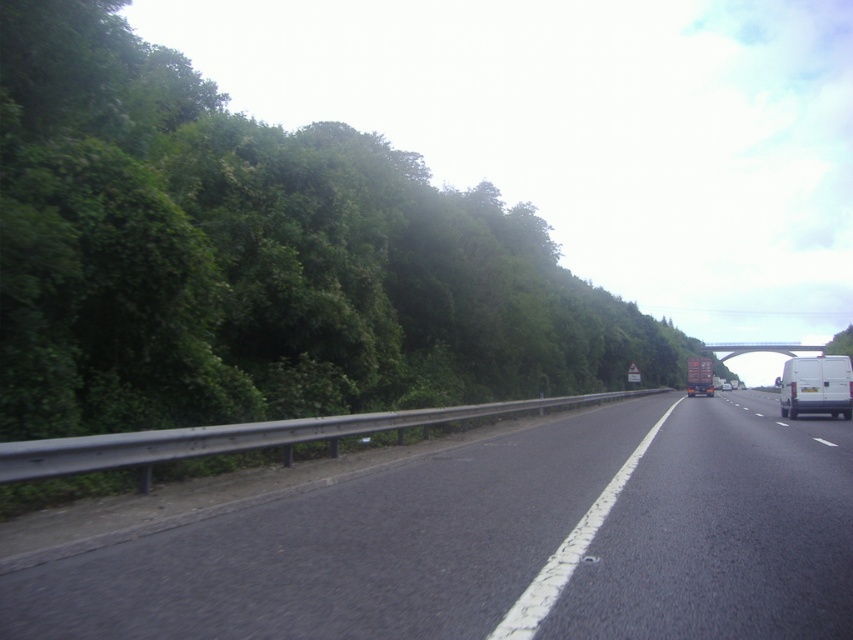
You are a delivery driver approaching a bridge on a two lane road. You see a white matte van at right and a green leafy tree at upper right. Which object is taller?

The white matte van at right has a greater height compared to the green leafy tree at upper right, so the white matte van at right is taller.

You are driving a car and see the green leafy trees at left and the metallic brown trailer truck at center. Which object is closer to the left side of the road?

The green leafy trees at left are closer to the left side of the road because they are positioned to the left of the metallic brown trailer truck at center.